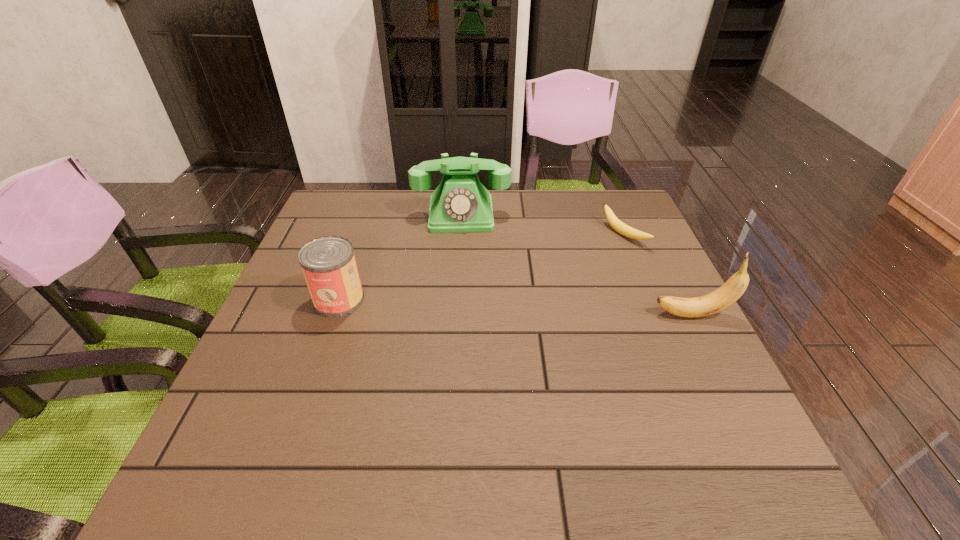
This screenshot has width=960, height=540. Find the location of `vacant region located on the upward curve of the shorter banana`. vacant region located on the upward curve of the shorter banana is located at coordinates (495, 300).

Find the location of a particular element. The width and height of the screenshot is (960, 540). blank space located 0.100m on the upward curve of the shorter banana is located at coordinates (586, 256).

Identify the location of blank area located 0.330m on the upward curve of the shorter banana. (516, 290).

The width and height of the screenshot is (960, 540). I want to click on free spot located on the dial of the telephone, so click(x=463, y=315).

Locate an element on the screen. The height and width of the screenshot is (540, 960). free space located 0.360m on the dial of the telephone is located at coordinates (463, 328).

Image resolution: width=960 pixels, height=540 pixels. Find the location of `vacant space located on the dial of the telephone`. vacant space located on the dial of the telephone is located at coordinates (463, 262).

Locate an element on the screen. Image resolution: width=960 pixels, height=540 pixels. banana situated at the far edge is located at coordinates (x=615, y=223).

This screenshot has width=960, height=540. In order to click on telephone situated at the far edge in this screenshot , I will do `click(460, 203)`.

The height and width of the screenshot is (540, 960). I want to click on object that is at the left edge, so click(328, 263).

Locate an element on the screen. The width and height of the screenshot is (960, 540). object at the far right corner is located at coordinates point(615,223).